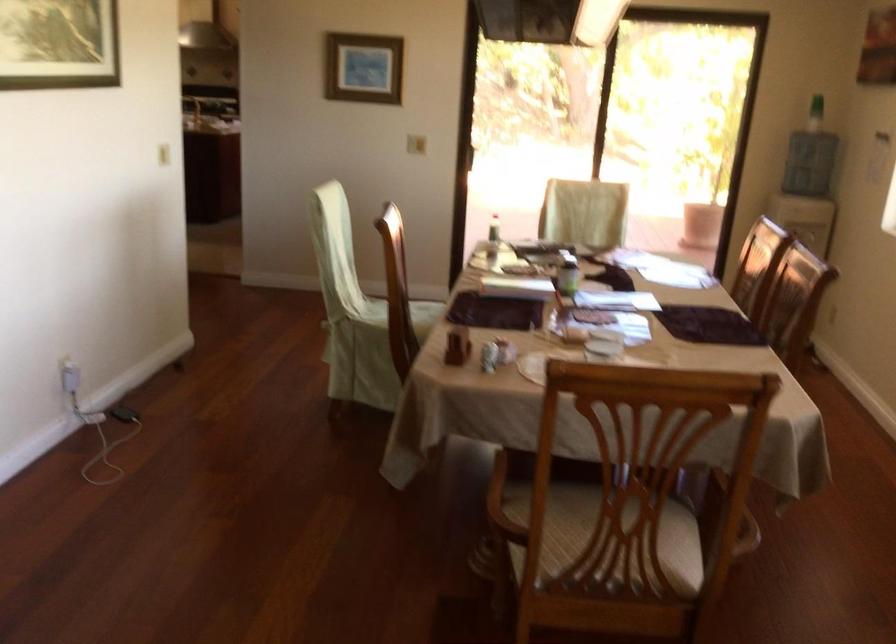
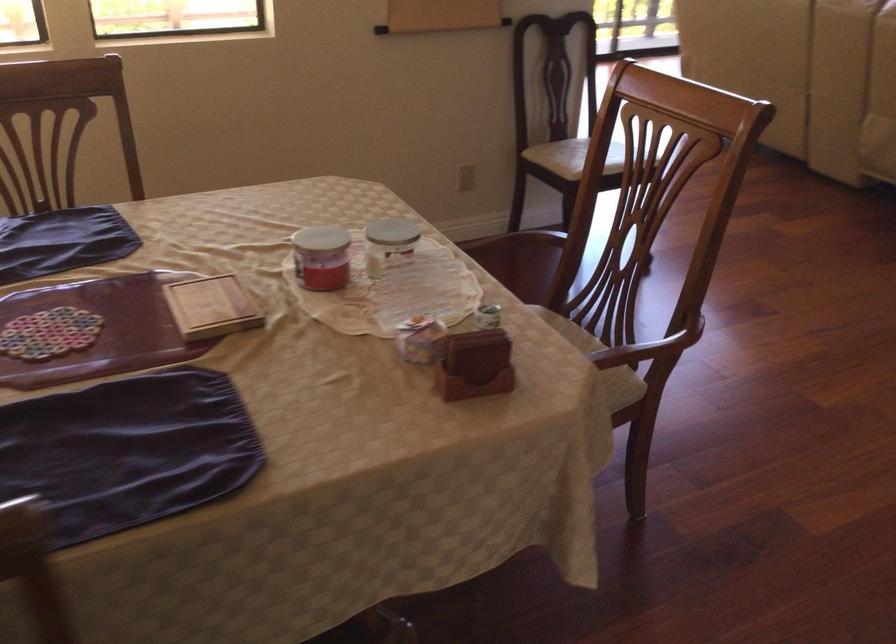
Find the pixel in the second image that matches point 591,346 in the first image.

(389, 243)